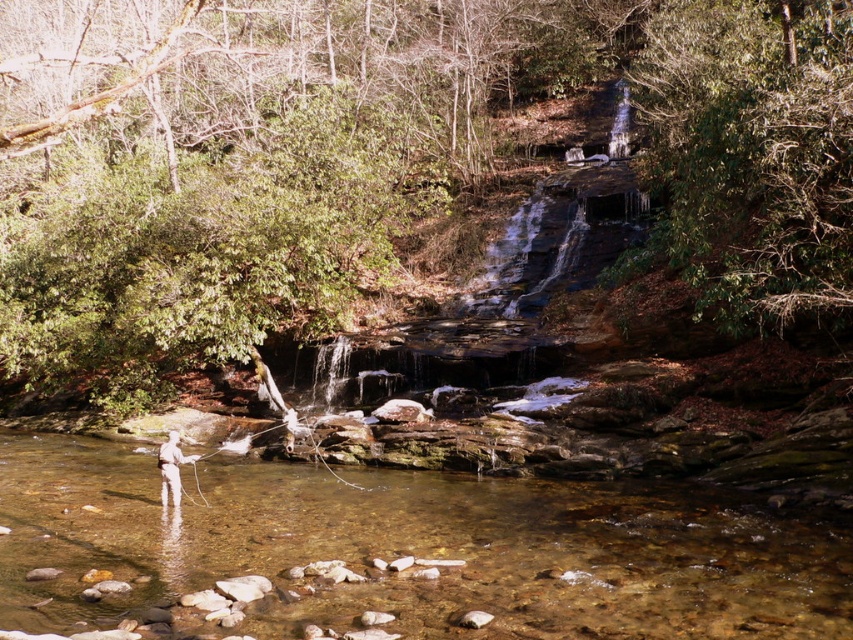
You are standing at the edge of the stream and want to walk to the green leafy tree at upper right without getting your feet wet. Which direction should you move relative to the green leafy tree at center?

You should move to the right of the green leafy tree at center to reach the green leafy tree at upper right without getting your feet wet.